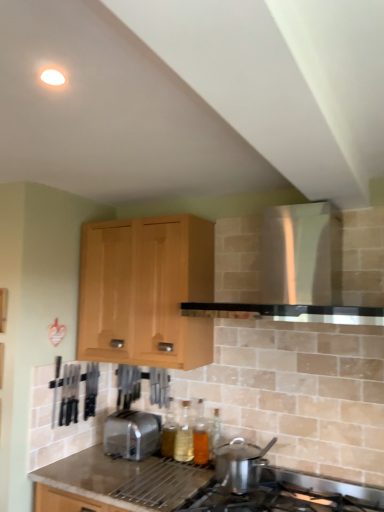
Question: Considering the relative positions of satin silver toaster at lower center and translucent glass bottle at lower center, positioned as the second bottle in right-to-left order, in the image provided, is satin silver toaster at lower center to the left or to the right of translucent glass bottle at lower center, positioned as the second bottle in right-to-left order,?

Choices:
 (A) left
 (B) right

Answer: (A)

Question: Considering the positions of point (147, 453) and point (178, 448), is point (147, 453) closer or farther from the camera than point (178, 448)?

Choices:
 (A) closer
 (B) farther

Answer: (A)

Question: Estimate the real-world distances between objects in this image. Which object is farther from the translucent glass bottle at center, the third bottle in the right-to-left sequence?

Choices:
 (A) white glossy vent at upper center
 (B) stainless steel pot at lower center
 (C) light wood cabinet at upper center
 (D) granite gray countertop at lower center
 (E) satin silver toaster at lower center

Answer: (A)

Question: Estimate the real-world distances between objects in this image. Which object is closer to the stainless steel pot at lower center?

Choices:
 (A) granite gray countertop at lower center
 (B) white glossy vent at upper center
 (C) translucent glass bottle at center, placed as the first bottle when sorted from left to right
 (D) light wood cabinet at upper center
 (E) satin silver toaster at lower center

Answer: (A)